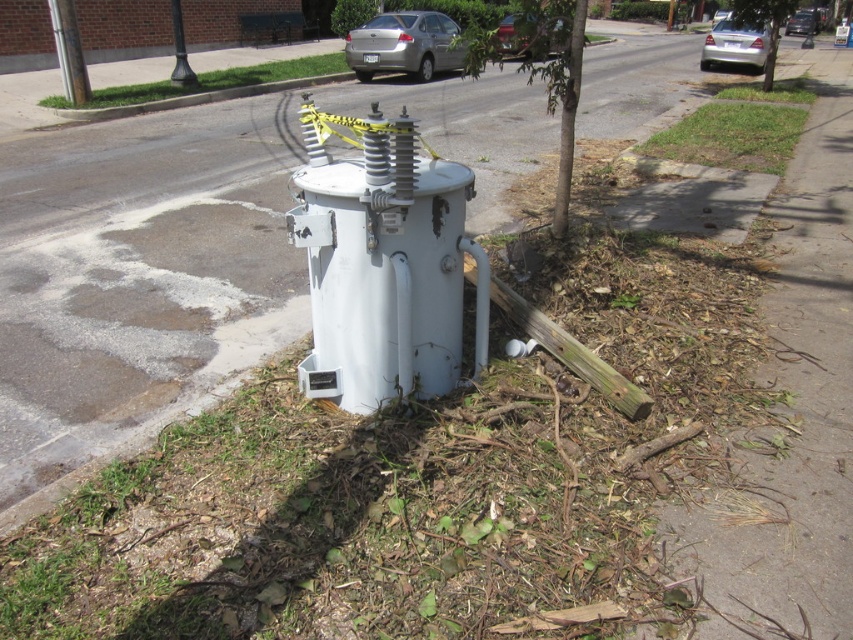
Question: Is white matte water heater at center wider than metallic silver sedan at upper center?

Choices:
 (A) no
 (B) yes

Answer: (A)

Question: Estimate the real-world distances between objects in this image. Which object is closer to the silver metallic sedan at upper center?

Choices:
 (A) green grass at lower right
 (B) green grass at upper center
 (C) white matte water heater at center

Answer: (B)

Question: Based on their relative distances, which object is farther from the green grass at lower right?

Choices:
 (A) silver metallic sedan at upper center
 (B) white matte water heater at center

Answer: (A)

Question: Does white matte water heater at center have a smaller size compared to silver metallic car at upper center?

Choices:
 (A) yes
 (B) no

Answer: (A)

Question: Does green grass at upper center lie in front of metallic silver sedan at upper center?

Choices:
 (A) no
 (B) yes

Answer: (A)

Question: Which of the following is the closest to the observer?

Choices:
 (A) green grass at upper center
 (B) silver metallic car at upper center
 (C) silver metallic car at upper right
 (D) silver metallic sedan at upper center

Answer: (A)